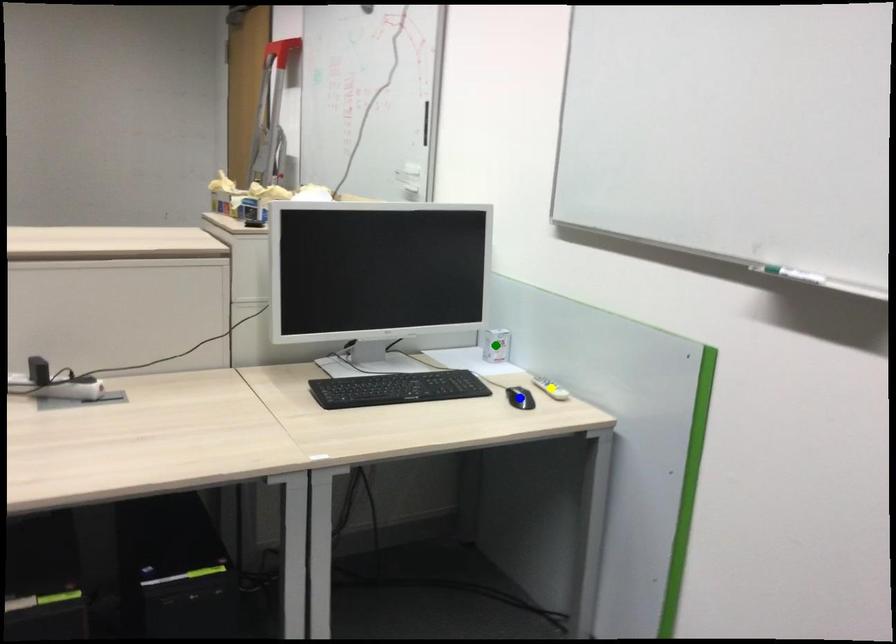
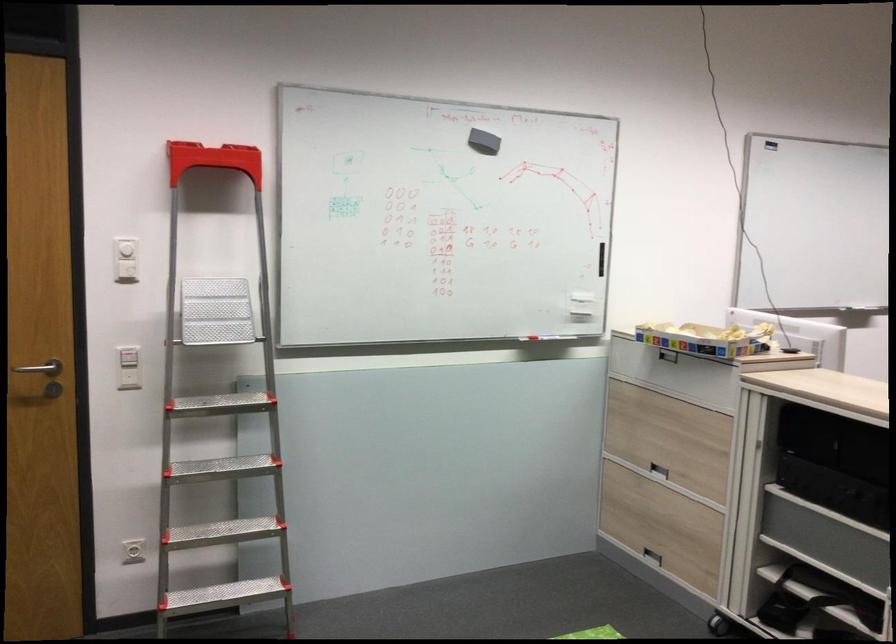
I am providing you with two images of the same scene from different viewpoints. Three points are marked in image1. Which point corresponds to a part or object that is occluded in image2?In image1, three points are marked. Which of them correspond to a part or object that is occluded in image2?Among the three points shown in image1, which one corresponds to a part or object that is no longer visible due to occlusion in image2?

green point, yellow point, blue point